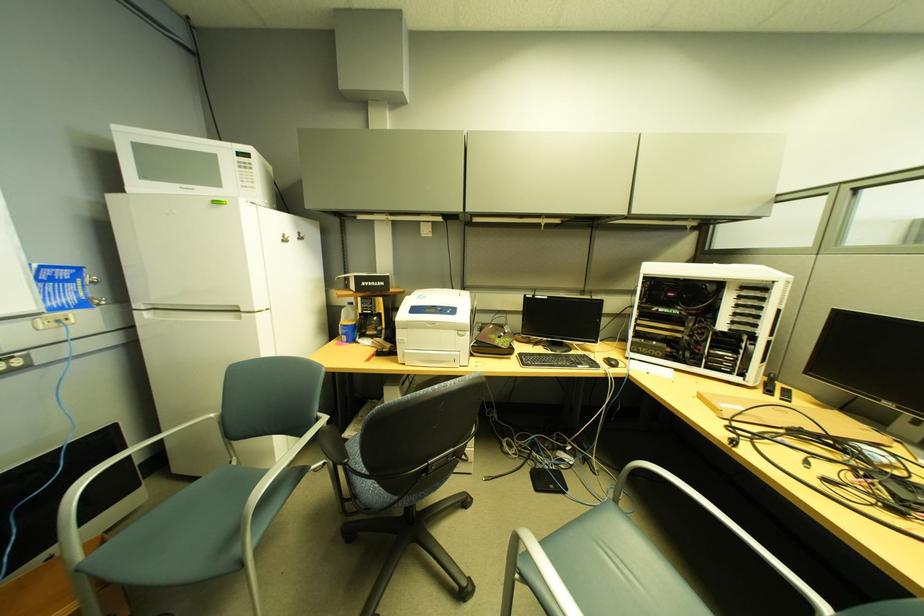
This screenshot has width=924, height=616. Identify the location of black chair armrest. (334, 445).